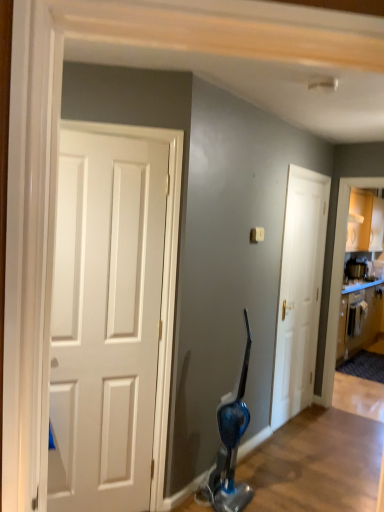
The width and height of the screenshot is (384, 512). Describe the element at coordinates (299, 292) in the screenshot. I see `white matte door at center` at that location.

What do you see at coordinates (355, 269) in the screenshot? This screenshot has height=512, width=384. I see `metallic silver toaster at upper right` at bounding box center [355, 269].

I want to click on wooden cabinet at right, so click(x=359, y=317).

How distant is metallic silver toaster at upper right from wooden cabinet at right?

metallic silver toaster at upper right is 1.23 meters from wooden cabinet at right.

Would you consider metallic silver toaster at upper right to be distant from wooden cabinet at right?

Absolutely, metallic silver toaster at upper right is distant from wooden cabinet at right.

Is metallic silver toaster at upper right to the left of wooden cabinet at right from the viewer's perspective?

Yes, metallic silver toaster at upper right is to the left of wooden cabinet at right.

From a real-world perspective, who is located higher, metallic silver toaster at upper right or wooden cabinet at right?

metallic silver toaster at upper right, from a real-world perspective.

Considering the points (352, 298) and (353, 268), which point is in front, point (352, 298) or point (353, 268)?

Point (353, 268)

Considering the relative sizes of wooden cabinet at right and metallic silver toaster at upper right in the image provided, is wooden cabinet at right wider than metallic silver toaster at upper right?

Indeed, wooden cabinet at right has a greater width compared to metallic silver toaster at upper right.

How different are the orientations of wooden cabinet at right and metallic silver toaster at upper right in degrees?

0.294 degrees.

Consider the image. Could metallic silver toaster at upper right be considered to be inside wooden cabinet at right?

No, metallic silver toaster at upper right is not a part of wooden cabinet at right.

From the image's perspective, is metallic silver toaster at upper right located above or below white matte door at center?

Based on their image positions, metallic silver toaster at upper right is located above white matte door at center.

Considering the positions of point (350, 273) and point (295, 181), is point (350, 273) closer or farther from the camera than point (295, 181)?

Point (350, 273) is positioned farther from the camera compared to point (295, 181).

Is the surface of metallic silver toaster at upper right in direct contact with white matte door at center?

No, metallic silver toaster at upper right is not in contact with white matte door at center.

Can you confirm if metallic silver toaster at upper right is smaller than white matte door at center?

Correct, metallic silver toaster at upper right occupies less space than white matte door at center.

Which is more to the left, wooden cabinet at right or white matte door at center?

white matte door at center.

From a real-world perspective, is wooden cabinet at right positioned under white matte door at center based on gravity?

Yes, from a real-world perspective, wooden cabinet at right is under white matte door at center.

Is wooden cabinet at right far from white matte door at center?

Yes.

Is wooden cabinet at right smaller than white matte door at center?

Incorrect, wooden cabinet at right is not smaller in size than white matte door at center.

Is white matte door at center further to the viewer compared to metallic silver toaster at upper right?

No, white matte door at center is closer to the camera.

Who is smaller, white matte door at center or metallic silver toaster at upper right?

metallic silver toaster at upper right.

Does white matte door at center have a greater height compared to metallic silver toaster at upper right?

Yes.

From a real-world perspective, which is physically above, white matte door at center or wooden cabinet at right?

white matte door at center is physically above.

Is white matte door at center to the right of wooden cabinet at right from the viewer's perspective?

In fact, white matte door at center is to the left of wooden cabinet at right.

Does white matte door at center turn towards wooden cabinet at right?

No.

The height and width of the screenshot is (512, 384). Identify the location of appliance above the wooden cabinet at right (from the image's perspective). (355, 269).

Locate an element on the screen. This screenshot has height=512, width=384. appliance that is above the wooden cabinet at right (from a real-world perspective) is located at coordinates click(355, 269).

Which object lies nearer to the anchor point white matte door at center, metallic silver toaster at upper right or wooden cabinet at right?

metallic silver toaster at upper right.

Based on their spatial positions, is white matte door at center or wooden cabinet at right further from metallic silver toaster at upper right?

white matte door at center lies further to metallic silver toaster at upper right than the other object.

When comparing their distances from wooden cabinet at right, does metallic silver toaster at upper right or white matte door at center seem further?

white matte door at center is further to wooden cabinet at right.

In the scene shown: Estimate the real-world distances between objects in this image. Which object is closer to metallic silver toaster at upper right, wooden cabinet at right or white matte door at center?

wooden cabinet at right is positioned closer to the anchor metallic silver toaster at upper right.

Estimate the real-world distances between objects in this image. Which object is further from white matte door at center, wooden cabinet at right or metallic silver toaster at upper right?

The object further to white matte door at center is wooden cabinet at right.

When comparing their distances from wooden cabinet at right, does white matte door at center or metallic silver toaster at upper right seem further?

white matte door at center is further to wooden cabinet at right.

You are a GUI agent. You are given a task and a screenshot of the screen. Output one action in this format:
    pyautogui.click(x=<x>, y=<y>)
    Task: Click on the cabinetry between white matte door at center and metallic silver toaster at upper right in the front-back direction
    Image resolution: width=384 pixels, height=512 pixels.
    Given the screenshot: What is the action you would take?
    pyautogui.click(x=359, y=317)